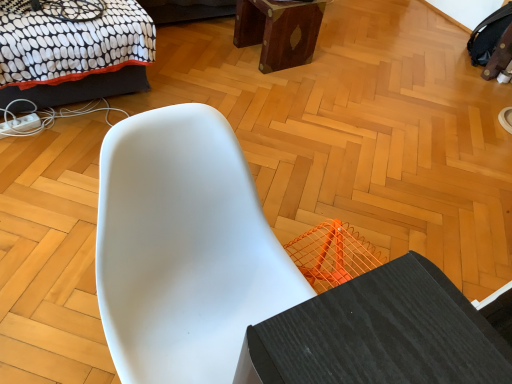
Question: From a real-world perspective, is black dotted fabric bed at upper left physically located above or below white matte chair at center?

Choices:
 (A) above
 (B) below

Answer: (B)

Question: From the image's perspective, is black dotted fabric bed at upper left positioned above or below white matte chair at center?

Choices:
 (A) below
 (B) above

Answer: (B)

Question: Which object is the closest to the white matte chair at center?

Choices:
 (A) black dotted fabric bed at upper left
 (B) mahogany wood stool at upper center

Answer: (A)

Question: Which object is positioned closest to the white matte chair at center?

Choices:
 (A) mahogany wood stool at upper center
 (B) black dotted fabric bed at upper left

Answer: (B)